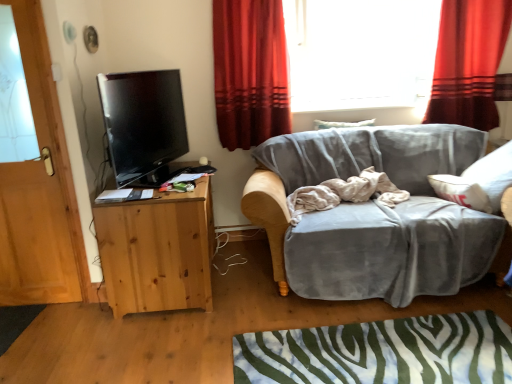
The width and height of the screenshot is (512, 384). What do you see at coordinates (40, 190) in the screenshot? I see `wooden door at left` at bounding box center [40, 190].

How much space does red velvet curtain at upper right, positioned as the first curtain in right-to-left order, occupy vertically?

1.04 meters.

What do you see at coordinates (143, 124) in the screenshot? The image size is (512, 384). I see `matte black tv at left` at bounding box center [143, 124].

Describe the element at coordinates (381, 352) in the screenshot. I see `green and white zebra-patterned rug at lower center` at that location.

I want to click on beige cotton blanket at center, so click(344, 193).

You are a GUI agent. You are given a task and a screenshot of the screen. Output one action in this format:
    pyautogui.click(x=<x>, y=<y>)
    Task: Click on the velvet gray couch at center
    The image size is (512, 384).
    Given the screenshot: What is the action you would take?
    pyautogui.click(x=376, y=214)

Is transparent glass window at upper center not within red velvet curtain at upper right, which is the 2th curtain in left-to-right order?

Absolutely, transparent glass window at upper center is external to red velvet curtain at upper right, which is the 2th curtain in left-to-right order.

From a real-world perspective, between transparent glass window at upper center and red velvet curtain at upper right, positioned as the first curtain in right-to-left order, who is vertically higher?

transparent glass window at upper center.

In the scene shown: Does transparent glass window at upper center have a lesser height compared to red velvet curtain at upper right, positioned as the first curtain in right-to-left order?

Indeed, transparent glass window at upper center has a lesser height compared to red velvet curtain at upper right, positioned as the first curtain in right-to-left order.

Which is behind, transparent glass window at upper center or red velvet curtain at upper right, which is the 2th curtain in left-to-right order?

transparent glass window at upper center is further away from the camera.

Which object is further away from the camera taking this photo, red velvet curtain at upper right, which is the 2th curtain in left-to-right order, or natural wood cabinet at left?

red velvet curtain at upper right, which is the 2th curtain in left-to-right order, is more distant.

Which object is thinner, red velvet curtain at upper right, which is the 2th curtain in left-to-right order, or natural wood cabinet at left?

red velvet curtain at upper right, which is the 2th curtain in left-to-right order, is thinner.

Is red velvet curtain at upper right, positioned as the first curtain in right-to-left order, surrounding natural wood cabinet at left?

No, natural wood cabinet at left is not a part of red velvet curtain at upper right, positioned as the first curtain in right-to-left order.

Which is farther, [215,0] or [116,224]?

The point [215,0] is farther from the camera.

Considering the relative positions of red velvet curtain at upper center, which is counted as the 1th curtain, starting from the left, and natural wood cabinet at left in the image provided, is red velvet curtain at upper center, which is counted as the 1th curtain, starting from the left, to the right of natural wood cabinet at left from the viewer's perspective?

Yes, red velvet curtain at upper center, which is counted as the 1th curtain, starting from the left, is to the right of natural wood cabinet at left.

Are red velvet curtain at upper center, arranged as the 2th curtain when viewed from the right, and natural wood cabinet at left beside each other?

No.

Would you say green and white zebra-patterned rug at lower center is a long distance from matte black tv at left?

green and white zebra-patterned rug at lower center is far away from matte black tv at left.

How many degrees apart are the facing directions of green and white zebra-patterned rug at lower center and matte black tv at left?

They differ by 161 degrees in their facing directions.

Choose the correct answer: Is green and white zebra-patterned rug at lower center inside matte black tv at left or outside it?

green and white zebra-patterned rug at lower center is located beyond the bounds of matte black tv at left.

The height and width of the screenshot is (384, 512). I want to click on television behind the green and white zebra-patterned rug at lower center, so click(143, 124).

Which object is positioned more to the right, natural wood cabinet at left or red velvet curtain at upper right, positioned as the first curtain in right-to-left order?

Positioned to the right is red velvet curtain at upper right, positioned as the first curtain in right-to-left order.

In the scene shown: Is natural wood cabinet at left thinner than red velvet curtain at upper right, which is the 2th curtain in left-to-right order?

In fact, natural wood cabinet at left might be wider than red velvet curtain at upper right, which is the 2th curtain in left-to-right order.

Can you confirm if natural wood cabinet at left is shorter than red velvet curtain at upper right, positioned as the first curtain in right-to-left order?

Yes.

Where is `curtain that is the 1st object above the natural wood cabinet at left (from a real-world perspective)`? curtain that is the 1st object above the natural wood cabinet at left (from a real-world perspective) is located at coordinates (468, 62).

From their relative heights in the image, would you say red velvet curtain at upper right, which is the 2th curtain in left-to-right order, is taller or shorter than wooden door at left?

Clearly, red velvet curtain at upper right, which is the 2th curtain in left-to-right order, is shorter compared to wooden door at left.

Are red velvet curtain at upper right, positioned as the first curtain in right-to-left order, and wooden door at left far apart?

red velvet curtain at upper right, positioned as the first curtain in right-to-left order, is positioned a significant distance from wooden door at left.

Is red velvet curtain at upper right, which is the 2th curtain in left-to-right order, wider than wooden door at left?

Yes.

Who is bigger, red velvet curtain at upper right, positioned as the first curtain in right-to-left order, or wooden door at left?

red velvet curtain at upper right, positioned as the first curtain in right-to-left order.

From a real-world perspective, which is physically above, natural wood cabinet at left or matte black tv at left?

From a 3D spatial view, matte black tv at left is above.

Which is more distant, (x=154, y=217) or (x=130, y=162)?

The point (x=130, y=162) is farther.

Are natural wood cabinet at left and matte black tv at left located far from each other?

No.

I want to click on television above the natural wood cabinet at left (from the image's perspective), so click(143, 124).

Locate an element on the screen. window above the red velvet curtain at upper right, which is the 2th curtain in left-to-right order (from the image's perspective) is located at coordinates (360, 52).

The image size is (512, 384). In order to click on the 2nd curtain behind when counting from the natural wood cabinet at left in this screenshot , I will do `click(468, 62)`.

Estimate the real-world distances between objects in this image. Which object is closer to green and white zebra-patterned rug at lower center, beige cotton blanket at center or red velvet curtain at upper center, arranged as the 2th curtain when viewed from the right?

Among the two, beige cotton blanket at center is located nearer to green and white zebra-patterned rug at lower center.

From the picture: Which object lies further to the anchor point natural wood cabinet at left, wooden door at left or transparent glass window at upper center?

transparent glass window at upper center is positioned further to the anchor natural wood cabinet at left.

Considering their positions, is natural wood cabinet at left positioned closer to wooden door at left than matte black tv at left?

Among the two, natural wood cabinet at left is located nearer to wooden door at left.

When comparing their distances from red velvet curtain at upper center, arranged as the 2th curtain when viewed from the right, does red velvet curtain at upper right, which is the 2th curtain in left-to-right order, or wooden door at left seem closer?

Among the two, wooden door at left is located nearer to red velvet curtain at upper center, arranged as the 2th curtain when viewed from the right.

Estimate the real-world distances between objects in this image. Which object is further from red velvet curtain at upper right, which is the 2th curtain in left-to-right order, red velvet curtain at upper center, arranged as the 2th curtain when viewed from the right, or natural wood cabinet at left?

natural wood cabinet at left is further to red velvet curtain at upper right, which is the 2th curtain in left-to-right order.

From the image, which object appears to be nearer to beige cotton blanket at center, red velvet curtain at upper center, arranged as the 2th curtain when viewed from the right, or red velvet curtain at upper right, which is the 2th curtain in left-to-right order?

red velvet curtain at upper center, arranged as the 2th curtain when viewed from the right, lies closer to beige cotton blanket at center than the other object.

Based on their spatial positions, is natural wood cabinet at left or green and white zebra-patterned rug at lower center closer to velvet gray couch at center?

Based on the image, green and white zebra-patterned rug at lower center appears to be nearer to velvet gray couch at center.

Looking at this image, estimate the real-world distances between objects in this image. Which object is further from red velvet curtain at upper right, positioned as the first curtain in right-to-left order, natural wood cabinet at left or beige cotton blanket at center?

natural wood cabinet at left is further to red velvet curtain at upper right, positioned as the first curtain in right-to-left order.

Identify the location of bedding between matte black tv at left and red velvet curtain at upper right, which is the 2th curtain in left-to-right order. (344, 193).

The image size is (512, 384). What are the coordinates of `bedding between transparent glass window at upper center and green and white zebra-patterned rug at lower center from top to bottom` in the screenshot? It's located at (344, 193).

Locate an element on the screen. curtain between red velvet curtain at upper right, positioned as the first curtain in right-to-left order, and green and white zebra-patterned rug at lower center from top to bottom is located at coordinates (250, 72).

At what (x,y) coordinates should I click in order to perform the action: click on plain between wooden door at left and red velvet curtain at upper right, which is the 2th curtain in left-to-right order. Please return your answer as a coordinate pair (x, y). This screenshot has width=512, height=384. Looking at the image, I should click on (381, 352).